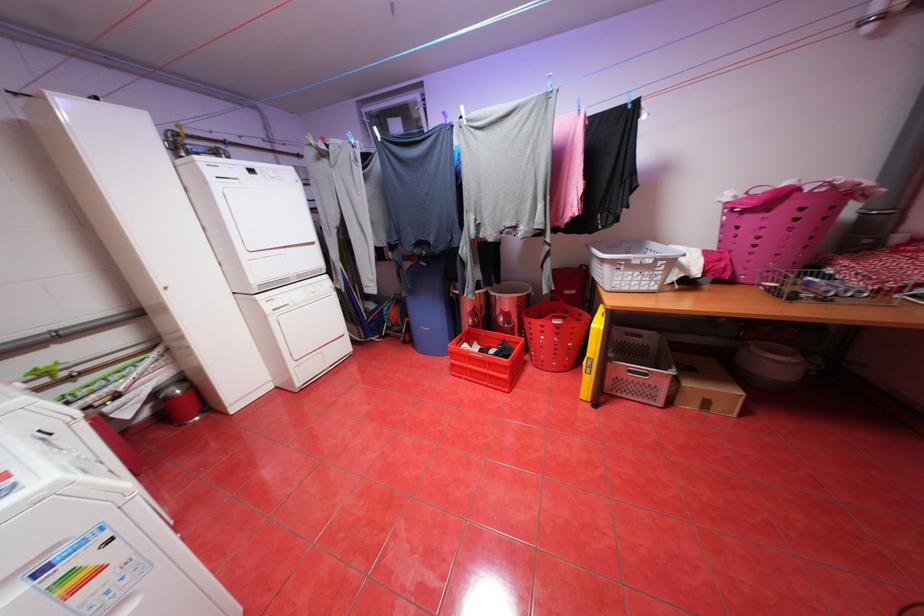
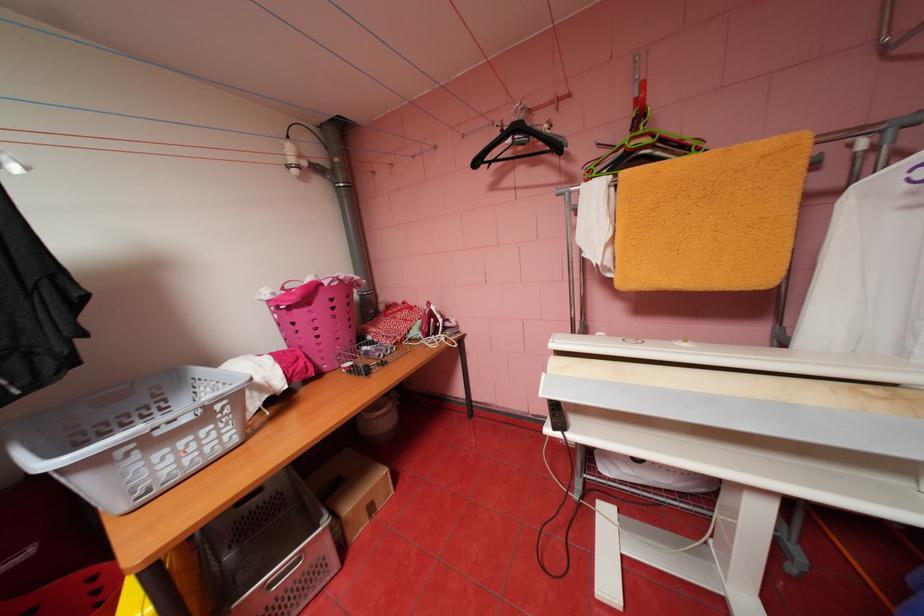
Locate, in the second image, the point that corresponds to point (756, 216) in the first image.

(304, 310)